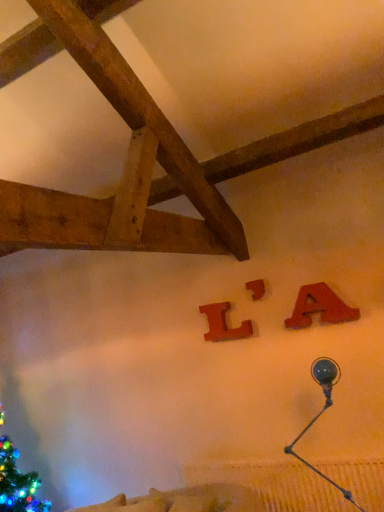
Question: Is wooden letter l at center, the first alphabet from the left, in front of metallic blue lamp at upper right?

Choices:
 (A) no
 (B) yes

Answer: (A)

Question: Is wooden letter l at center, acting as the 3th alphabet starting from the front, further to the viewer compared to metallic blue lamp at upper right?

Choices:
 (A) yes
 (B) no

Answer: (A)

Question: Is wooden letter l at center, the first alphabet from the left, at the left side of metallic blue lamp at upper right?

Choices:
 (A) no
 (B) yes

Answer: (B)

Question: Is wooden letter l at center, acting as the 3th alphabet starting from the front, not near metallic blue lamp at upper right?

Choices:
 (A) yes
 (B) no

Answer: (B)

Question: Is metallic blue lamp at upper right located within wooden letter l at center, the 3th alphabet positioned from the right?

Choices:
 (A) yes
 (B) no

Answer: (B)

Question: Is wooden letter l at center, the 1th alphabet positioned from the back, aimed at metallic blue lamp at upper right?

Choices:
 (A) yes
 (B) no

Answer: (B)

Question: Is matte wood letter a at upper right, the third alphabet from the left, taller than matte wood letter at center, which appears as the second alphabet when viewed from the back?

Choices:
 (A) no
 (B) yes

Answer: (B)

Question: From a real-world perspective, is matte wood letter a at upper right, the first alphabet viewed from the right, located beneath matte wood letter at center, which appears as the second alphabet when viewed from the back?

Choices:
 (A) yes
 (B) no

Answer: (A)

Question: Are matte wood letter a at upper right, arranged as the third alphabet when viewed from the back, and matte wood letter at center, acting as the 2th alphabet starting from the front, far apart?

Choices:
 (A) yes
 (B) no

Answer: (B)

Question: Considering the relative sizes of matte wood letter a at upper right, which is the first alphabet from front to back, and matte wood letter at center, which ranks as the second alphabet in right-to-left order, in the image provided, is matte wood letter a at upper right, which is the first alphabet from front to back, shorter than matte wood letter at center, which ranks as the second alphabet in right-to-left order,?

Choices:
 (A) yes
 (B) no

Answer: (B)

Question: From the image's perspective, is matte wood letter a at upper right, the third alphabet from the left, located beneath matte wood letter at center, the second alphabet in the left-to-right sequence?

Choices:
 (A) no
 (B) yes

Answer: (B)

Question: Does matte wood letter a at upper right, which is the first alphabet from front to back, appear on the left side of matte wood letter at center, which ranks as the second alphabet in right-to-left order?

Choices:
 (A) yes
 (B) no

Answer: (B)

Question: Is matte wood letter at center, the second alphabet in the left-to-right sequence, positioned with its back to metallic blue lamp at upper right?

Choices:
 (A) yes
 (B) no

Answer: (B)